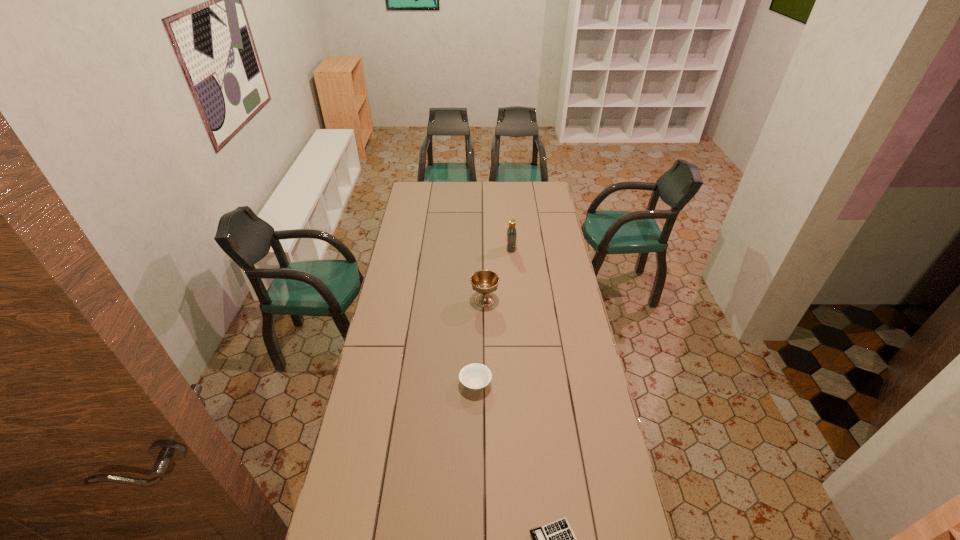
You are a GUI agent. You are given a task and a screenshot of the screen. Output one action in this format:
    pyautogui.click(x=<x>, y=<y>)
    Task: Click on the free space that satisfies the following two spatial constraints: 1. on the front-facing side of the vodka; 2. on the front side of the third farthest object
    This screenshot has height=540, width=960.
    Given the screenshot: What is the action you would take?
    pyautogui.click(x=523, y=383)